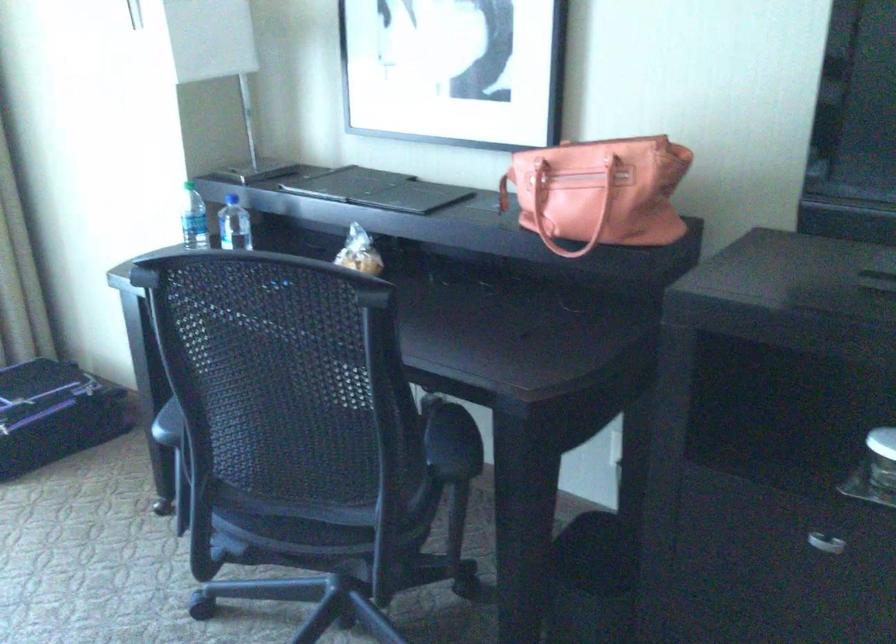
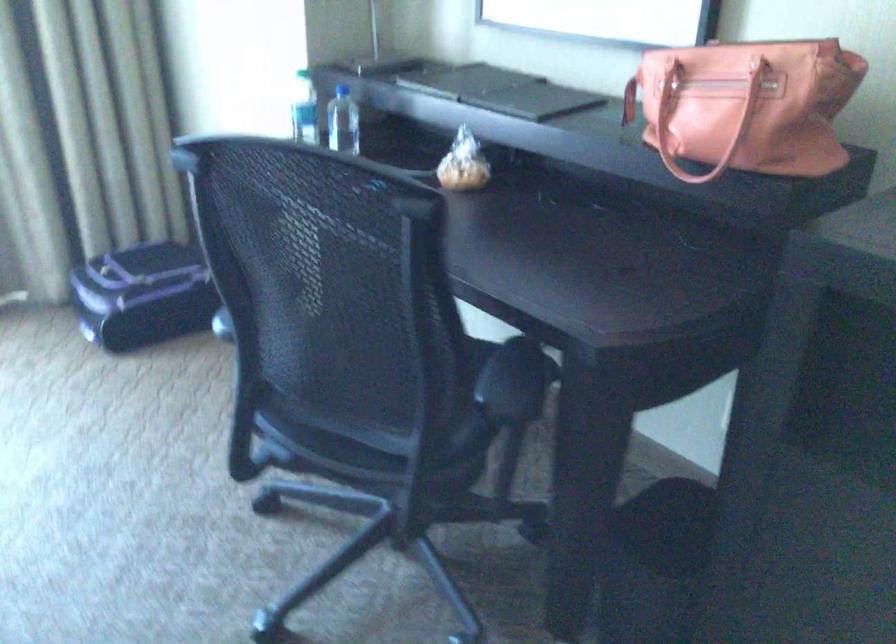
Locate, in the second image, the point that corresponds to point 356,258 in the first image.

(462, 164)